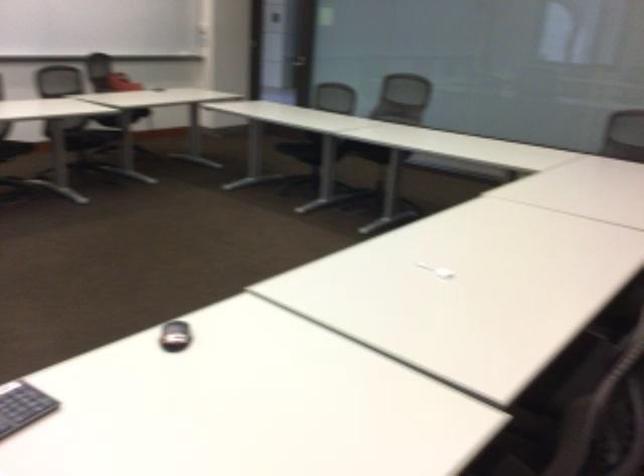
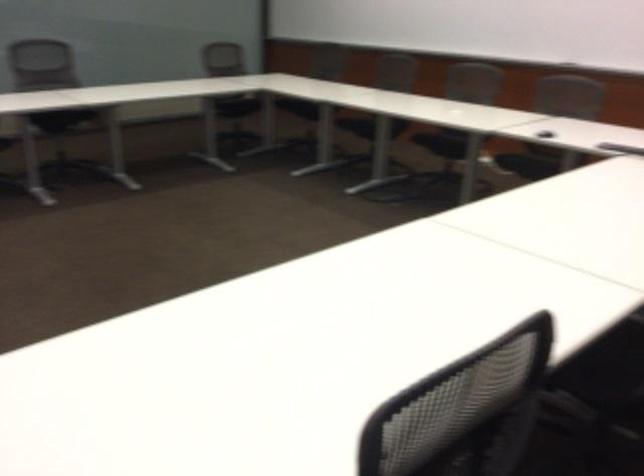
How did the camera likely rotate?

The camera rotated toward right-down.